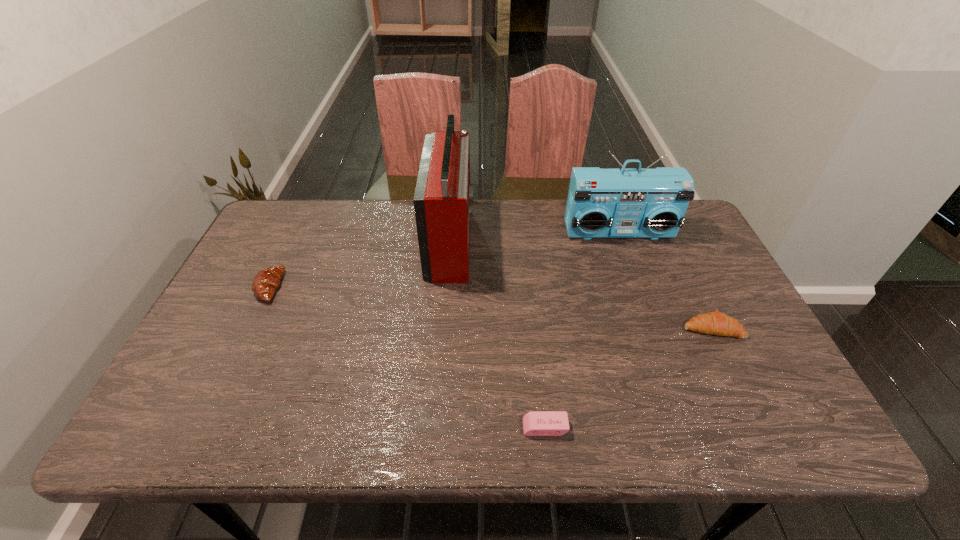
The width and height of the screenshot is (960, 540). Identify the location of the taller radio receiver. (442, 201).

Locate an element on the screen. The width and height of the screenshot is (960, 540). the tallest object is located at coordinates (442, 201).

Locate an element on the screen. the right radio receiver is located at coordinates tap(602, 203).

Where is `the shorter radio receiver`? the shorter radio receiver is located at coordinates (602, 203).

This screenshot has width=960, height=540. I want to click on the left crescent roll, so click(266, 281).

Where is `the farther crescent roll`? The image size is (960, 540). the farther crescent roll is located at coordinates (266, 281).

Identify the location of the right crescent roll. (716, 323).

Locate an element on the screen. This screenshot has height=540, width=960. the second nearest object is located at coordinates (716, 323).

Where is `eraser`? eraser is located at coordinates (535, 423).

Identify the location of the nearest object. This screenshot has height=540, width=960. (535, 423).